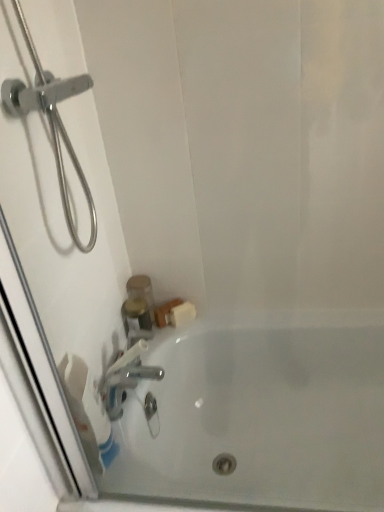
This screenshot has width=384, height=512. I want to click on spots to the right of white matte toilet paper at lower left, so click(146, 467).